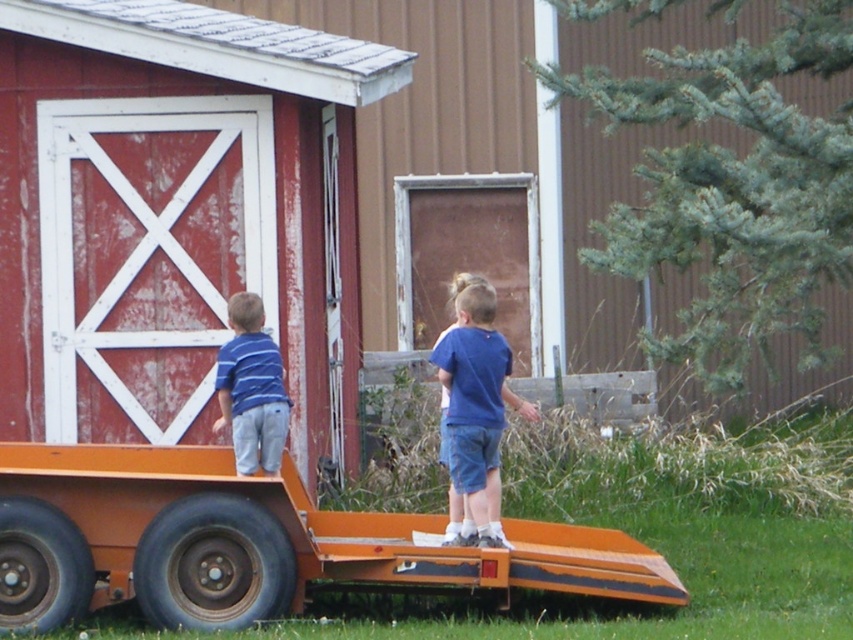
Question: In this image, where is red painted wood barn door at left located relative to blue striped shirt at left?

Choices:
 (A) right
 (B) left

Answer: (B)

Question: Among these points, which one is farthest from the camera?

Choices:
 (A) (254, 397)
 (B) (328, 576)

Answer: (A)

Question: Does blue cotton shirt at center appear under blue striped shirt at left?

Choices:
 (A) yes
 (B) no

Answer: (A)

Question: Which object is the closest to the blue cotton shirt at center?

Choices:
 (A) red painted wood barn door at left
 (B) orange matte trailer truck at lower left
 (C) blue striped shirt at left

Answer: (B)

Question: Estimate the real-world distances between objects in this image. Which object is farther from the red painted wood barn door at left?

Choices:
 (A) orange matte trailer truck at lower left
 (B) blue cotton shirt at center

Answer: (B)

Question: From the image, what is the correct spatial relationship of red painted wood barn door at left in relation to blue striped shirt at left?

Choices:
 (A) below
 (B) above

Answer: (B)